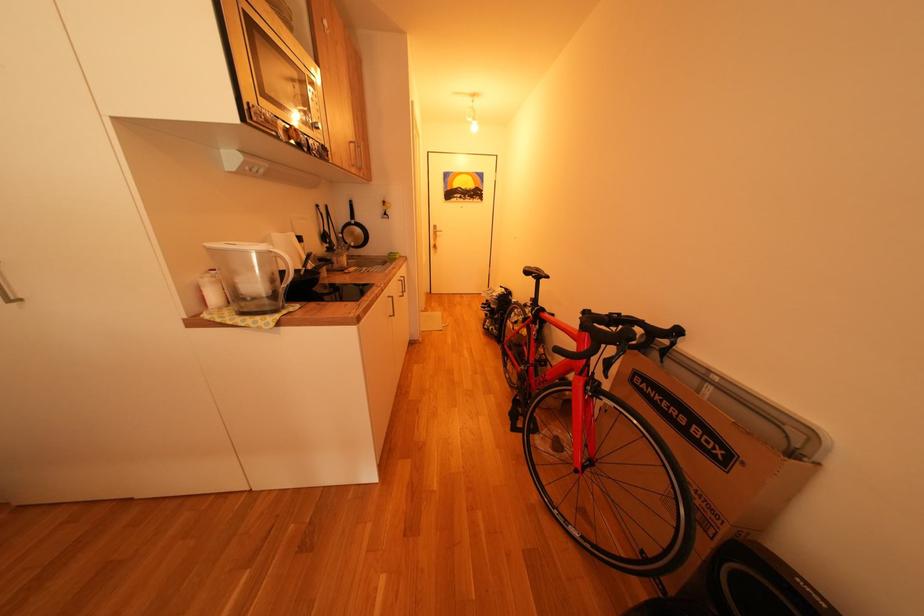
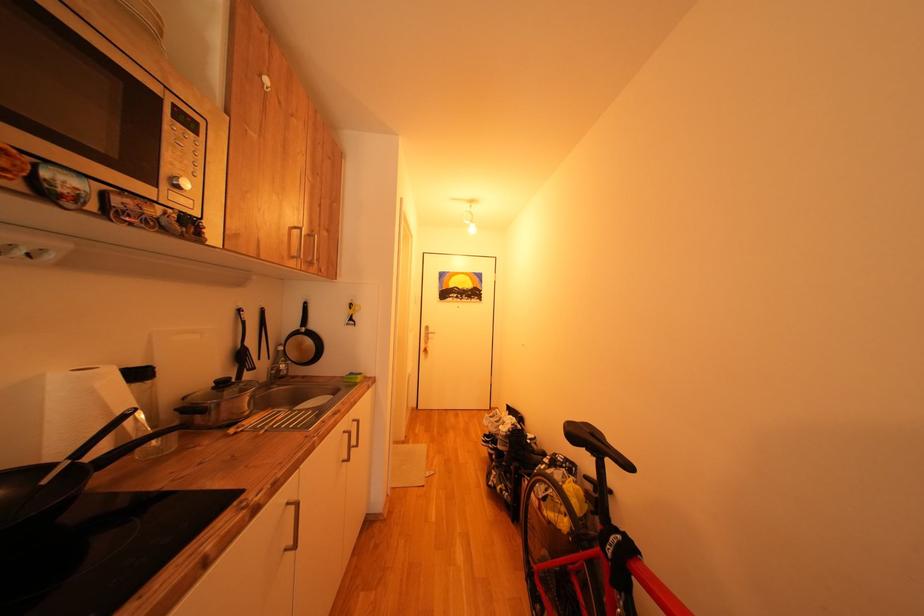
Question: Based on the continuous images, in which direction is the camera rotating? Reply with the corresponding letter.

Choices:
 (A) Left
 (B) Right
 (C) Up
 (D) Down

Answer: (C)